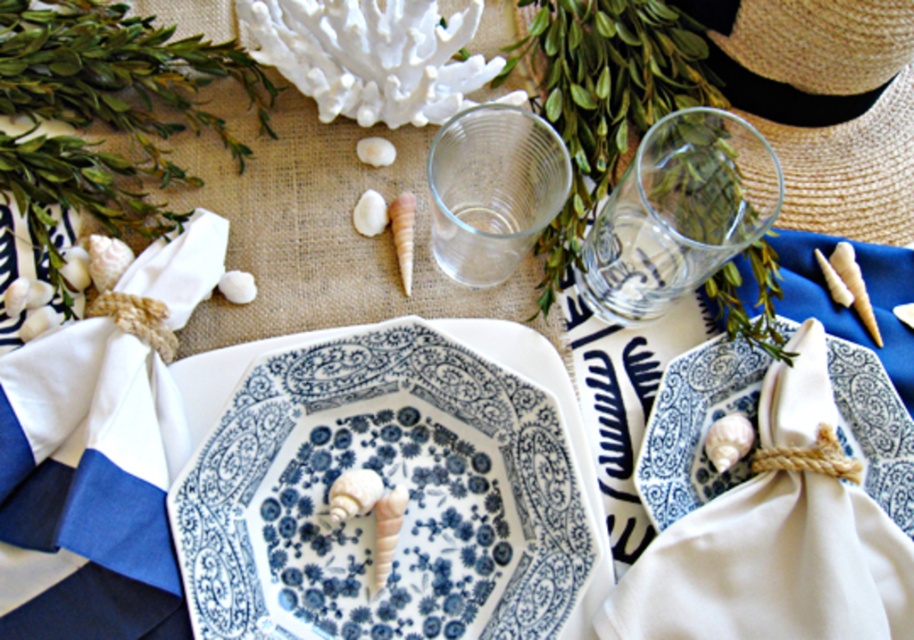
Question: Observing the image, what is the correct spatial positioning of white satin napkin at center in reference to clear glass cup at center?

Choices:
 (A) above
 (B) below

Answer: (B)

Question: Is blue and white porcelain platter at center below white cotton napkin at left?

Choices:
 (A) no
 (B) yes

Answer: (B)

Question: Which point is closer to the camera?

Choices:
 (A) (517, 145)
 (B) (76, 541)
 (C) (647, 157)
 (D) (813, 90)

Answer: (B)

Question: Based on their relative distances, which object is nearer to the white satin napkin at center?

Choices:
 (A) blue and white porcelain platter at center
 (B) white cotton napkin at left
 (C) clear glass cup at center

Answer: (A)

Question: Can you confirm if blue and white porcelain platter at center is positioned to the right of white cotton napkin at left?

Choices:
 (A) yes
 (B) no

Answer: (A)

Question: Which object is farther from the camera taking this photo?

Choices:
 (A) clear glass cup at center
 (B) blue and white porcelain platter at center

Answer: (A)